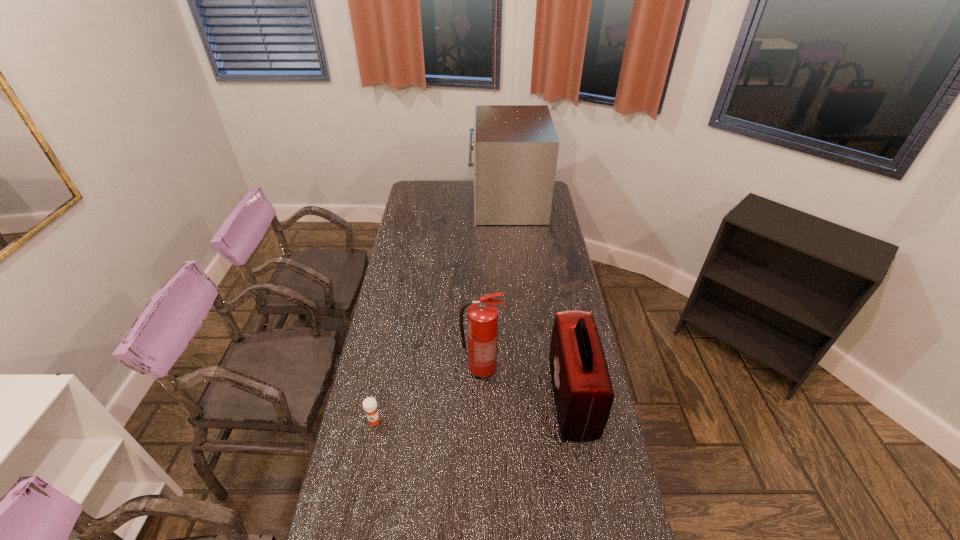
Where is `vacant space in between the first aid kit and the tallest object`? The width and height of the screenshot is (960, 540). vacant space in between the first aid kit and the tallest object is located at coordinates (540, 300).

Where is `object that stands as the second closest to the toaster oven`? object that stands as the second closest to the toaster oven is located at coordinates [482, 315].

Find the location of a particular element. This screenshot has width=960, height=540. object that can be found as the second closest to the third shortest object is located at coordinates (369, 404).

Identify the location of free region that satisfies the following two spatial constraints: 1. on the front panel of the farthest object; 2. on the label side of the leftmost object. The width and height of the screenshot is (960, 540). (526, 421).

The height and width of the screenshot is (540, 960). What are the coordinates of `vacant space that satisfies the following two spatial constraints: 1. on the handle side the fire extinguisher; 2. on the label side of the shortest object` in the screenshot? It's located at (482, 421).

Locate an element on the screen. vacant position in the image that satisfies the following two spatial constraints: 1. on the side of the first aid kit with the cross symbol; 2. on the label side of the medicine is located at coordinates (576, 421).

At what (x,y) coordinates should I click in order to perform the action: click on vacant region that satisfies the following two spatial constraints: 1. on the handle side the third shortest object; 2. on the label side of the shortest object. Please return your answer as a coordinate pair (x, y). Looking at the image, I should click on (482, 421).